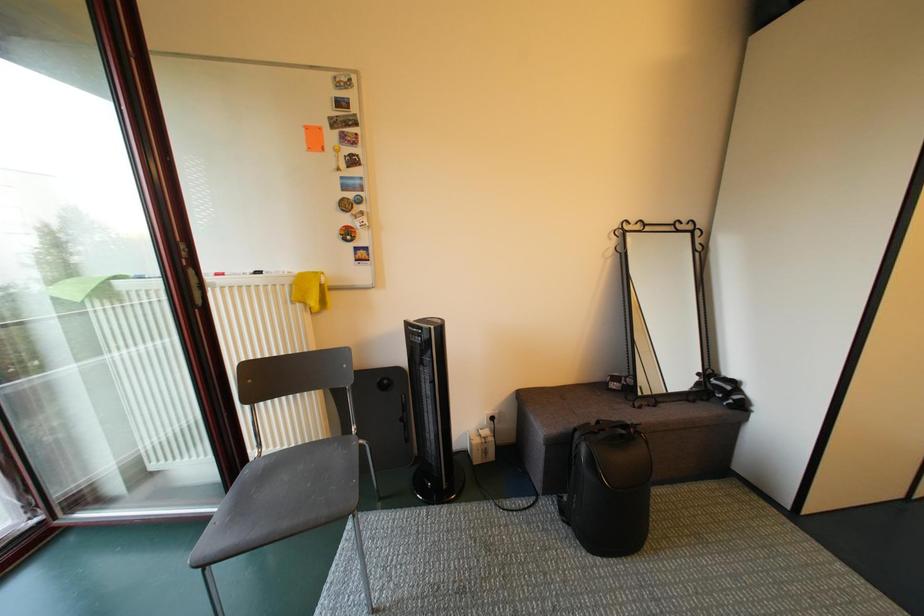
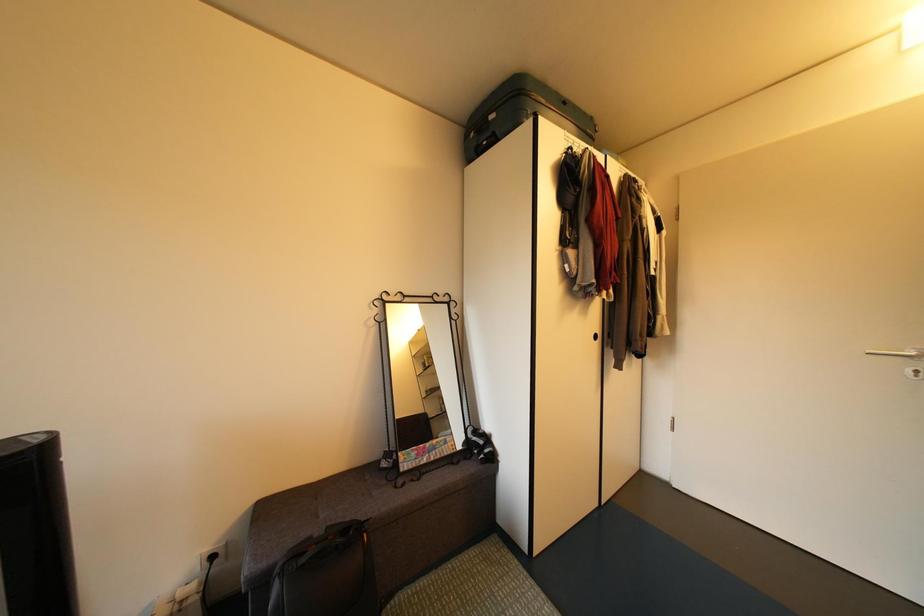
Question: The images are taken continuously from a first-person perspective. In which direction are you moving?

Choices:
 (A) Left
 (B) Right
 (C) Forward
 (D) Backward

Answer: (B)